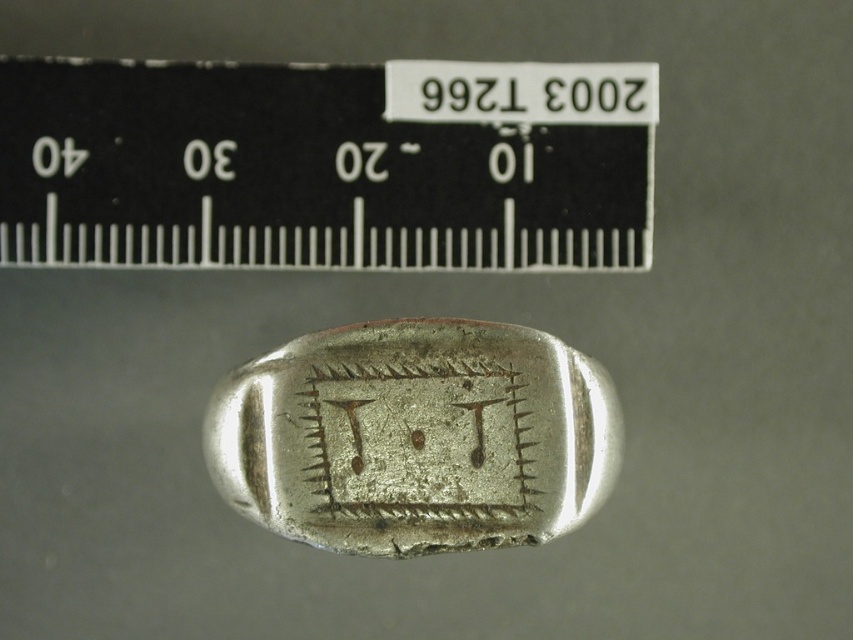
Question: Which point is farther to the camera?

Choices:
 (A) shiny silver ring at center
 (B) black plastic ruler at upper center

Answer: (B)

Question: Is the position of black plastic ruler at upper center more distant than that of shiny silver ring at center?

Choices:
 (A) yes
 (B) no

Answer: (A)

Question: In this image, where is black plastic ruler at upper center located relative to shiny silver ring at center?

Choices:
 (A) below
 (B) above

Answer: (B)

Question: Is black plastic ruler at upper center to the right of shiny silver ring at center from the viewer's perspective?

Choices:
 (A) yes
 (B) no

Answer: (B)

Question: Which point appears farthest from the camera in this image?

Choices:
 (A) (329, 360)
 (B) (183, 93)

Answer: (B)

Question: Which point is closer to the camera?

Choices:
 (A) shiny silver ring at center
 (B) black plastic ruler at upper center

Answer: (A)